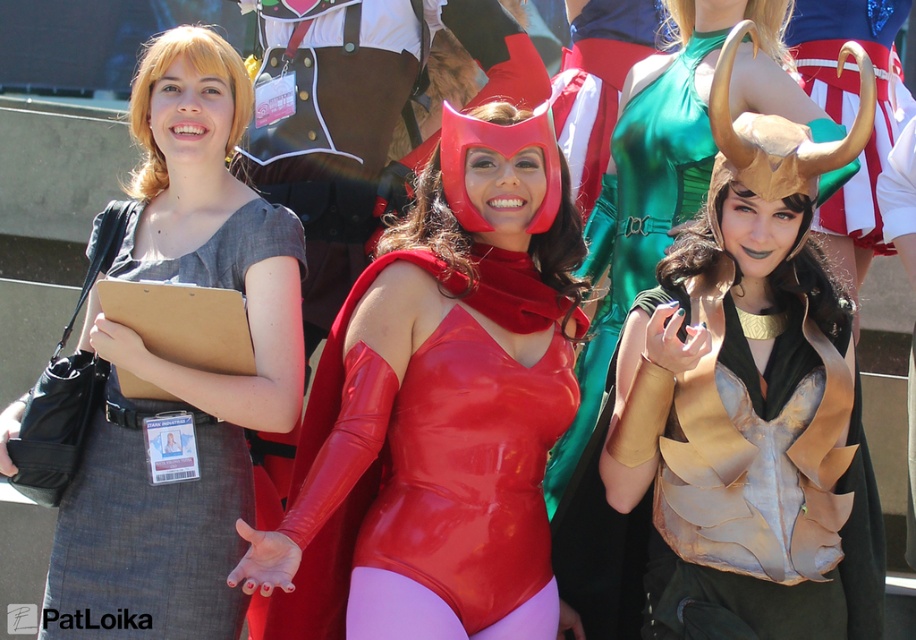
Based on the photo, you are standing at the entrance of the cosplay event and see two points marked in the image. The first point is at coordinates point (770, 528) and the second point is at point (398, 472). Which point is closer to you?

Point (770, 528) is in front of point (398, 472), so it is closer to you.

Based on the scene description, which object is positioned lower between the gold metallic armor at center and the matte gray dress at center?

The gold metallic armor at center is positioned lower than the matte gray dress at center.

You are standing at the center of the image and want to move towards the point labeled as point (846, 380). Is this point in front of or behind the point labeled as point (153, 164)?

The point labeled as point (846, 380) is in front of the point labeled as point (153, 164).